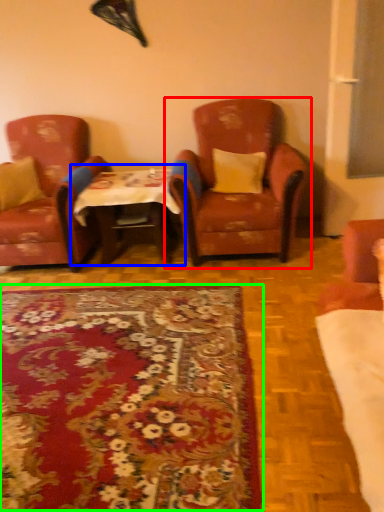
Question: Based on their relative distances, which object is nearer to chair (highlighted by a red box)? Choose from table (highlighted by a blue box) and mat (highlighted by a green box).

Choices:
 (A) table
 (B) mat

Answer: (A)